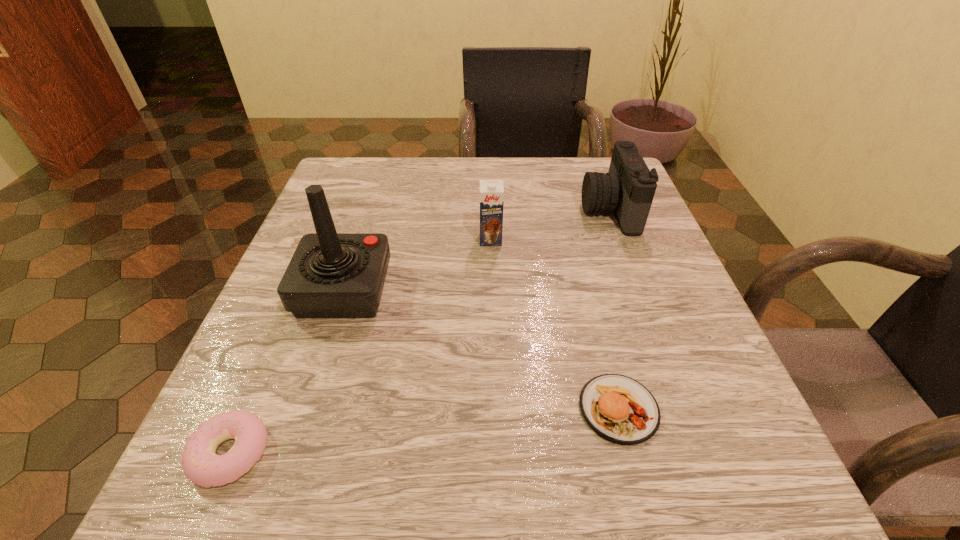
Locate an element on the screen. The width and height of the screenshot is (960, 540). blank space located 0.400m at the lens of the camera is located at coordinates (399, 210).

Where is `vacant area situated 0.090m on the back of the patty`? This screenshot has height=540, width=960. vacant area situated 0.090m on the back of the patty is located at coordinates (598, 329).

At what (x,y) coordinates should I click in order to perform the action: click on vacant space situated on the back of the shortest object. Please return your answer as a coordinate pair (x, y). The image size is (960, 540). Looking at the image, I should click on (312, 260).

I want to click on object positioned at the far edge, so click(x=628, y=189).

Find the location of a particular element. Image resolution: width=960 pixels, height=540 pixels. patty at the near edge is located at coordinates (618, 408).

I want to click on doughnut situated at the near edge, so click(201, 465).

This screenshot has height=540, width=960. Find the location of `joystick positioned at the left edge`. joystick positioned at the left edge is located at coordinates (331, 275).

At what (x,y) coordinates should I click in order to perform the action: click on doughnut at the left edge. Please return your answer as a coordinate pair (x, y). The width and height of the screenshot is (960, 540). Looking at the image, I should click on (201, 465).

At what (x,y) coordinates should I click in order to perform the action: click on camera positioned at the right edge. Please return your answer as a coordinate pair (x, y). Looking at the image, I should click on (628, 189).

Locate an element on the screen. The height and width of the screenshot is (540, 960). patty located at the right edge is located at coordinates (618, 408).